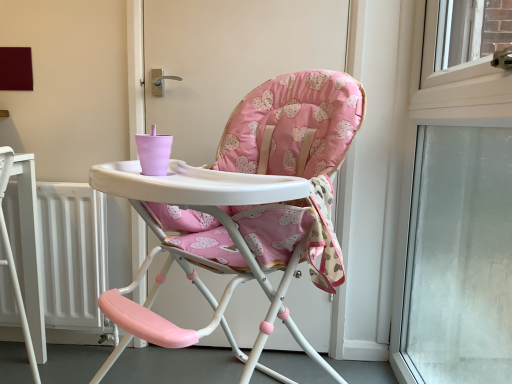
Question: Does point (406, 221) appear closer or farther from the camera than point (47, 319)?

Choices:
 (A) closer
 (B) farther

Answer: (A)

Question: Is transparent glass window at right inside the boundaries of white matte radiator at lower left, or outside?

Choices:
 (A) outside
 (B) inside

Answer: (A)

Question: Which object is positioned farthest from the pink fabric highchair at center?

Choices:
 (A) white matte radiator at lower left
 (B) transparent glass window at right

Answer: (A)

Question: Which object is positioned closest to the transparent glass window at right?

Choices:
 (A) pink fabric highchair at center
 (B) white matte radiator at lower left

Answer: (A)